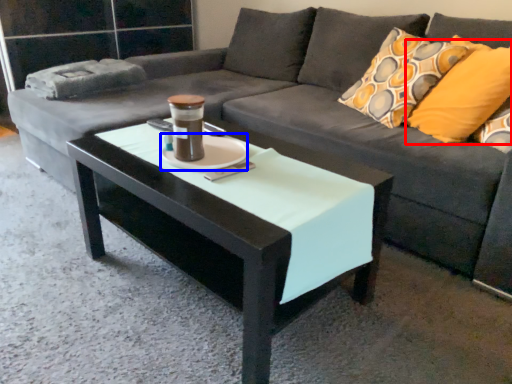
Question: Which object is closer to the camera taking this photo, pillow (highlighted by a red box) or saucer (highlighted by a blue box)?

Choices:
 (A) pillow
 (B) saucer

Answer: (B)